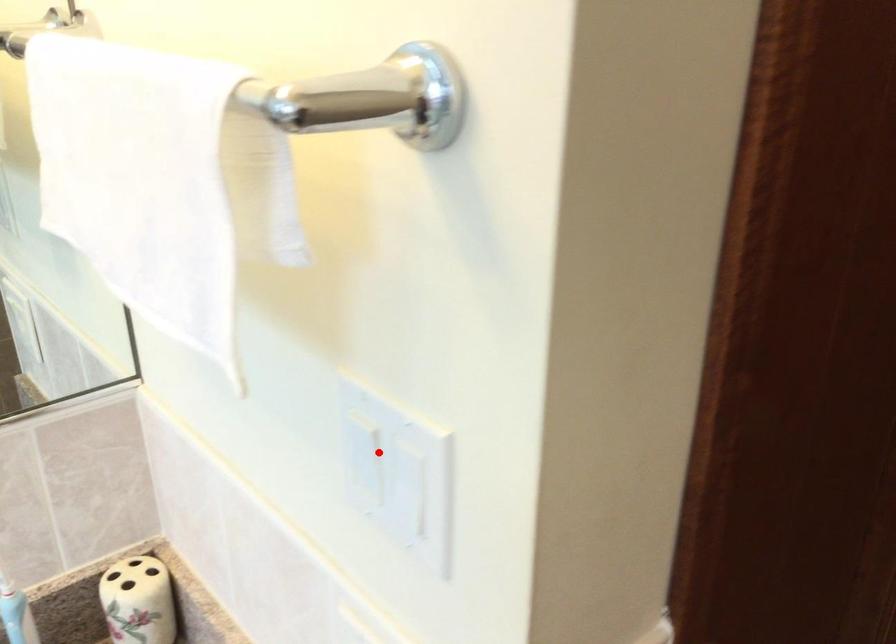
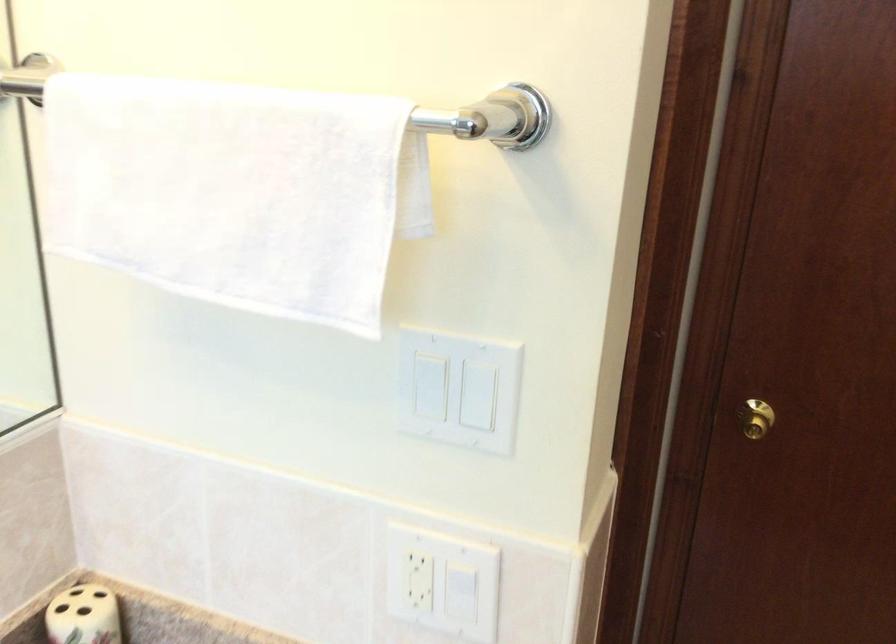
Question: A red point is marked in image1. In image2, is the corresponding 3D point closer to the camera or farther? Reply with the corresponding letter.

Choices:
 (A) The corresponding 3D point is closer.
 (B) The corresponding 3D point is farther.

Answer: (B)